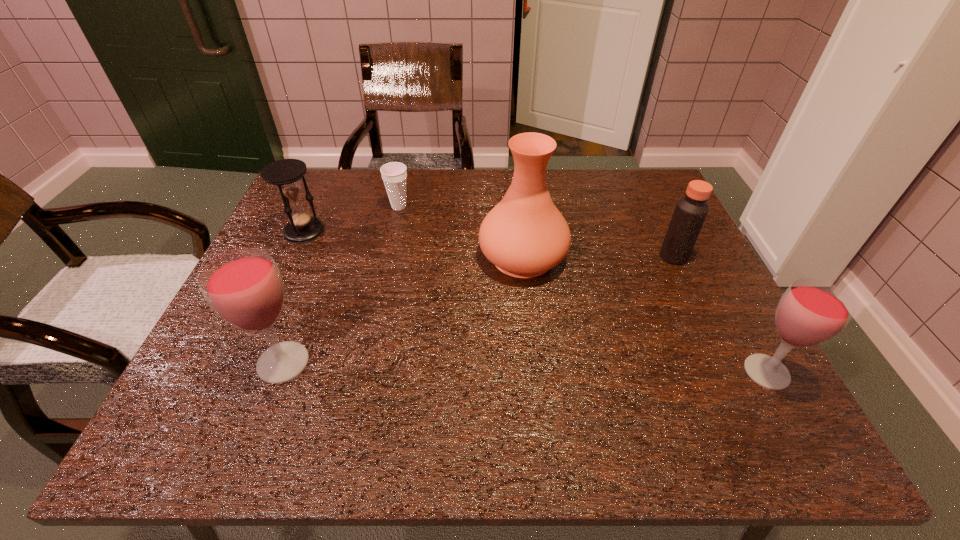
Identify the location of the taller wineglass. (244, 287).

Image resolution: width=960 pixels, height=540 pixels. I want to click on the left wineglass, so click(x=244, y=287).

Identify the location of the right wineglass. This screenshot has height=540, width=960. click(811, 311).

Locate an element on the screen. the fourth object from right to left is located at coordinates (394, 174).

Locate an element on the screen. cup is located at coordinates click(x=394, y=174).

This screenshot has width=960, height=540. Identify the location of hourglass. (286, 173).

Identify the location of vinegar. This screenshot has width=960, height=540. [690, 212].

Locate an element on the screen. The image size is (960, 540). the third object from right to left is located at coordinates (524, 235).

Locate an element on the screen. Image resolution: width=960 pixels, height=540 pixels. vase is located at coordinates (524, 235).

Locate an element on the screen. The height and width of the screenshot is (540, 960). vacant space located 0.340m on the back of the fifth shortest object is located at coordinates (331, 237).